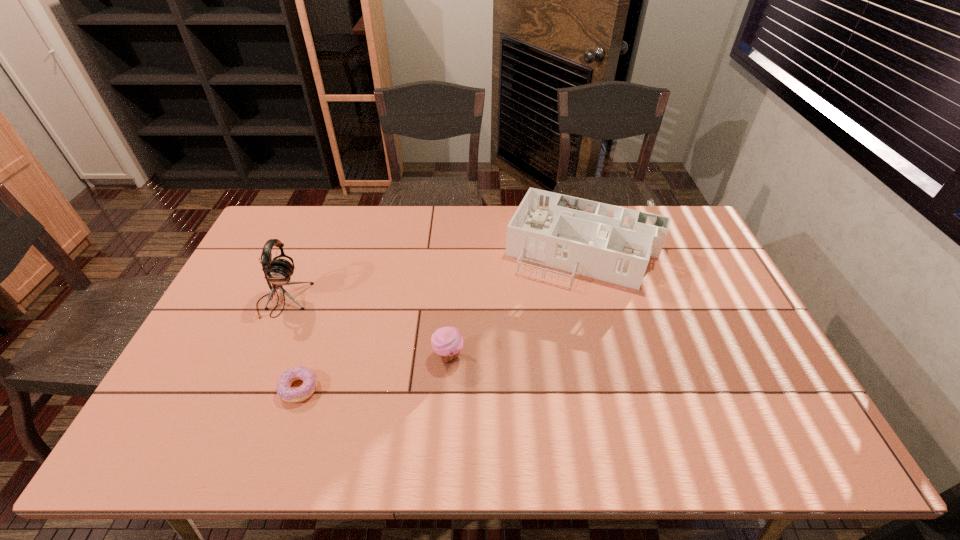
Where is `earphone`? earphone is located at coordinates (277, 271).

This screenshot has height=540, width=960. I want to click on the tallest object, so click(277, 271).

The height and width of the screenshot is (540, 960). I want to click on dollhouse, so click(614, 244).

Identify the location of the third shortest object. The width and height of the screenshot is (960, 540). (614, 244).

The width and height of the screenshot is (960, 540). I want to click on the third tallest object, so click(x=447, y=342).

Image resolution: width=960 pixels, height=540 pixels. I want to click on cupcake, so click(447, 342).

Locate an element on the screen. The height and width of the screenshot is (540, 960). doughnut is located at coordinates (285, 392).

I want to click on the shortest object, so click(x=285, y=392).

This screenshot has width=960, height=540. In order to click on free space located 0.220m on the front of the tallest object in this screenshot , I will do `click(246, 384)`.

The width and height of the screenshot is (960, 540). In order to click on free region located 0.340m on the left of the second tallest object in this screenshot , I will do `click(406, 249)`.